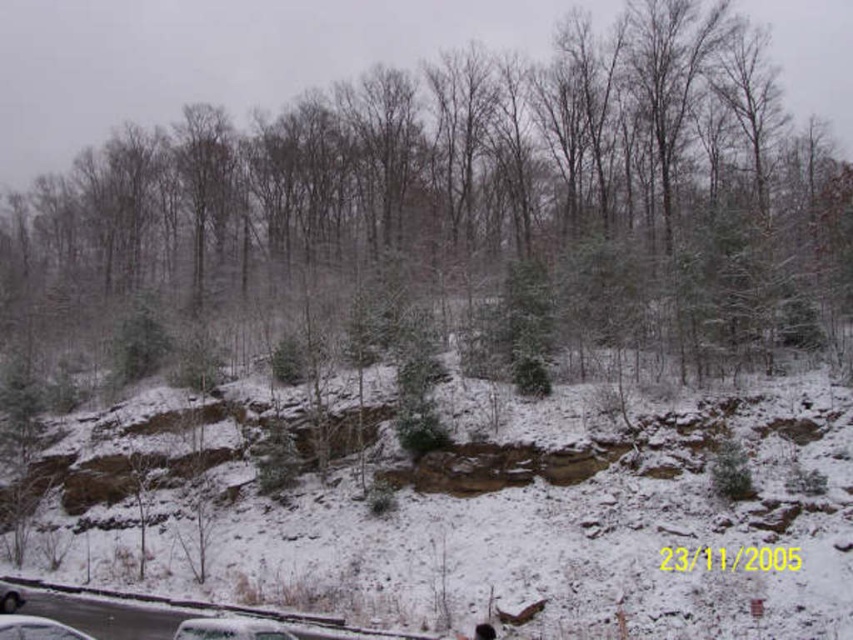
Question: From the image, what is the correct spatial relationship of snowy rock at center in relation to silver metallic car at lower left?

Choices:
 (A) above
 (B) below

Answer: (A)

Question: Among these points, which one is nearest to the camera?

Choices:
 (A) [3, 632]
 (B) [212, 634]

Answer: (A)

Question: In this image, where is snowy rock at center located relative to silver metallic car at lower left?

Choices:
 (A) above
 (B) below

Answer: (A)

Question: Which object is closer to the camera taking this photo?

Choices:
 (A) white glossy car at lower center
 (B) snowy rock at center
 (C) silver metallic car at lower left

Answer: (A)

Question: Which point is closer to the camera taking this photo?

Choices:
 (A) (30, 584)
 (B) (520, 556)

Answer: (B)

Question: In this image, where is white matte car at lower left located relative to silver metallic car at lower left?

Choices:
 (A) left
 (B) right

Answer: (B)